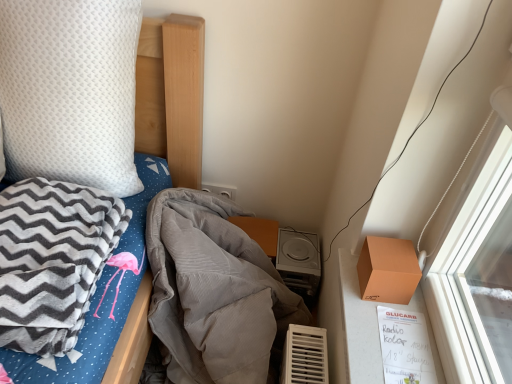
Question: In which direction should I rotate to look at white plastic power plugs and sockets at upper center?

Choices:
 (A) right
 (B) left

Answer: (B)

Question: Can you confirm if orange matte box at right is positioned to the right of gray fleece blanket at left, the second blanket in the right-to-left sequence?

Choices:
 (A) no
 (B) yes

Answer: (B)

Question: Is orange matte box at right bigger than gray fleece blanket at left, the 1th blanket when ordered from left to right?

Choices:
 (A) no
 (B) yes

Answer: (A)

Question: Is orange matte box at right turned away from gray fleece blanket at left, the second blanket in the right-to-left sequence?

Choices:
 (A) yes
 (B) no

Answer: (B)

Question: Is orange matte box at right thinner than gray fleece blanket at left, the 1th blanket when ordered from left to right?

Choices:
 (A) no
 (B) yes

Answer: (B)

Question: From the image's perspective, does orange matte box at right appear lower than gray fleece blanket at left, the 1th blanket when ordered from left to right?

Choices:
 (A) no
 (B) yes

Answer: (B)

Question: Is the depth of orange matte box at right less than that of gray fleece blanket at left, the second blanket in the right-to-left sequence?

Choices:
 (A) yes
 (B) no

Answer: (B)

Question: Is white plastic power plugs and sockets at upper center beside gray corduroy blanket at center, marked as the second blanket in a left-to-right arrangement?

Choices:
 (A) no
 (B) yes

Answer: (A)

Question: Can you confirm if white plastic power plugs and sockets at upper center is thinner than gray corduroy blanket at center, marked as the second blanket in a left-to-right arrangement?

Choices:
 (A) yes
 (B) no

Answer: (A)

Question: Does white plastic power plugs and sockets at upper center appear on the left side of gray corduroy blanket at center, marked as the second blanket in a left-to-right arrangement?

Choices:
 (A) no
 (B) yes

Answer: (B)

Question: Could gray corduroy blanket at center, marked as the first blanket in a right-to-left arrangement, be considered to be inside white plastic power plugs and sockets at upper center?

Choices:
 (A) yes
 (B) no

Answer: (B)

Question: From a real-world perspective, is white plastic power plugs and sockets at upper center located higher than gray corduroy blanket at center, marked as the second blanket in a left-to-right arrangement?

Choices:
 (A) yes
 (B) no

Answer: (A)

Question: Considering the relative sizes of white plastic power plugs and sockets at upper center and gray corduroy blanket at center, marked as the second blanket in a left-to-right arrangement, in the image provided, is white plastic power plugs and sockets at upper center smaller than gray corduroy blanket at center, marked as the second blanket in a left-to-right arrangement,?

Choices:
 (A) yes
 (B) no

Answer: (A)

Question: Is white textured pillow at upper left thinner than white plastic power plugs and sockets at upper center?

Choices:
 (A) yes
 (B) no

Answer: (B)